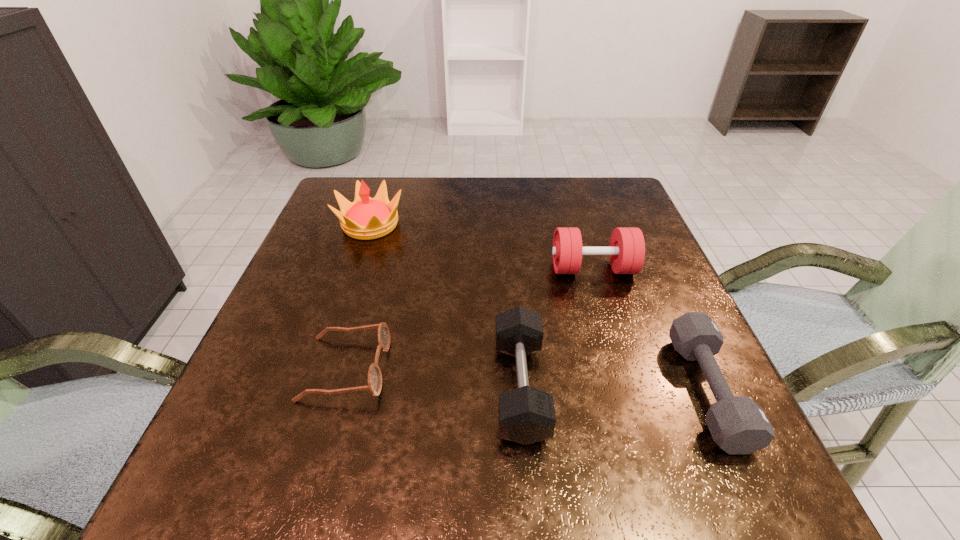
You are a GUI agent. You are given a task and a screenshot of the screen. Output one action in this format:
    pyautogui.click(x=<x>, y=<y>)
    Task: Click on the farthest object
    This screenshot has height=540, width=960.
    Given the screenshot: What is the action you would take?
    pyautogui.click(x=366, y=218)

I want to click on crown, so click(366, 218).

Where is `the farthest dumbbell`? The width and height of the screenshot is (960, 540). the farthest dumbbell is located at coordinates (626, 251).

You are a GUI agent. You are given a task and a screenshot of the screen. Output one action in this format:
    pyautogui.click(x=<x>, y=<y>)
    Task: Click on the leftmost dumbbell
    This screenshot has width=960, height=540.
    Given the screenshot: What is the action you would take?
    pyautogui.click(x=526, y=415)

In order to click on the second shortest object in this screenshot , I will do `click(738, 425)`.

Locate an element on the screen. The height and width of the screenshot is (540, 960). spectacles is located at coordinates (374, 385).

You are a GUI agent. You are given a task and a screenshot of the screen. Output one action in this format:
    pyautogui.click(x=<x>, y=<y>)
    Task: Click on the blank space located on the front of the crown
    This screenshot has height=540, width=960.
    Given the screenshot: What is the action you would take?
    pyautogui.click(x=346, y=299)

I want to click on vacant space located on the front of the fourth nearest object, so click(x=610, y=325).

The height and width of the screenshot is (540, 960). Find the location of `free space located on the left of the leftmost dumbbell`. free space located on the left of the leftmost dumbbell is located at coordinates (468, 388).

The width and height of the screenshot is (960, 540). Find the location of `blank space located on the left of the fourth tallest object`. blank space located on the left of the fourth tallest object is located at coordinates (597, 391).